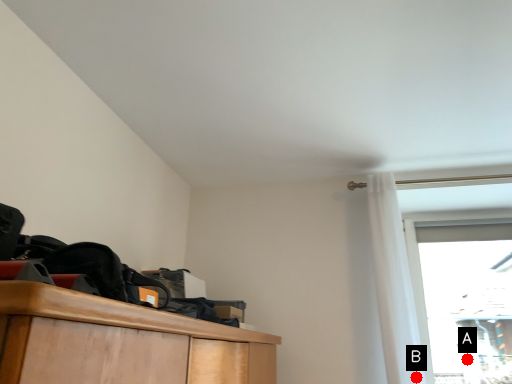
Question: Two points are circled on the image, labeled by A and B beside each circle. Which point is farther from the camera taking this photo?

Choices:
 (A) A is further
 (B) B is further

Answer: (A)